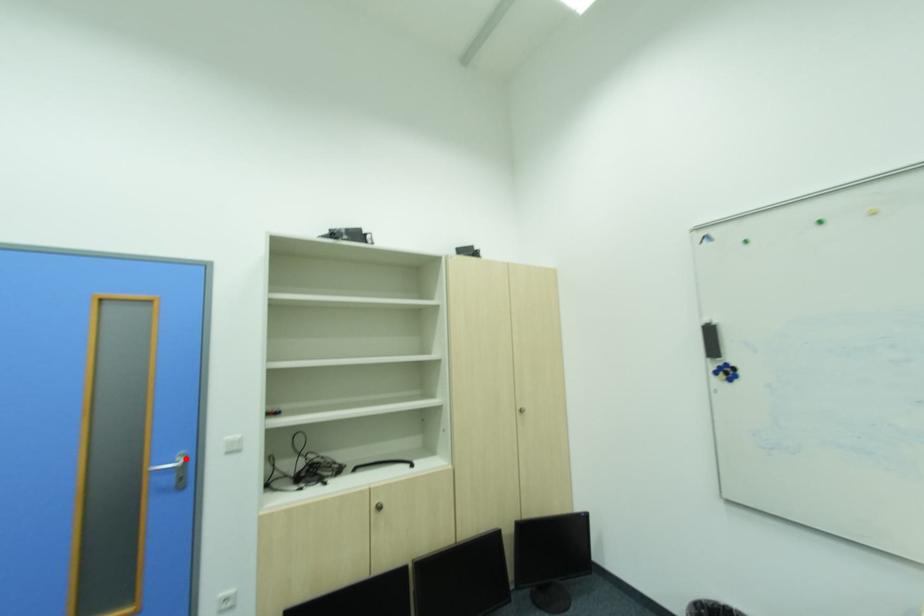
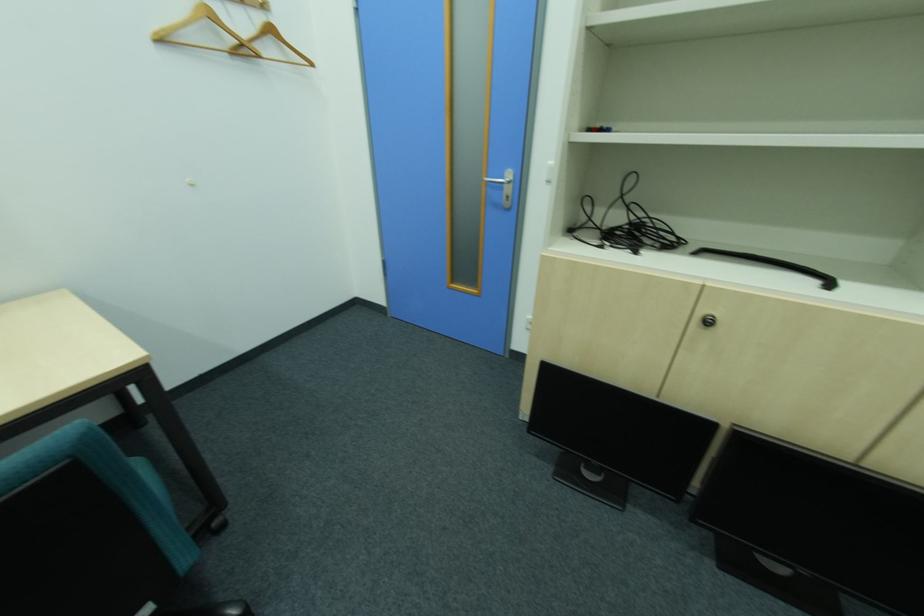
Question: I am providing you with two images of the same scene from different viewpoints. Given a red point in image1, look at the same physical point in image2. Is it:

Choices:
 (A) Closer to the viewpoint
 (B) Farther from the viewpoint

Answer: (A)